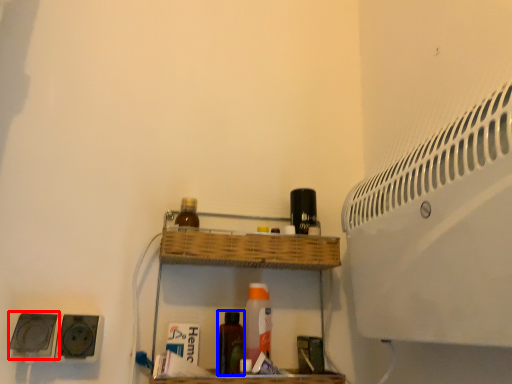
Question: Which object is further to the camera taking this photo, speaker (highlighted by a red box) or bottle (highlighted by a blue box)?

Choices:
 (A) speaker
 (B) bottle

Answer: (B)